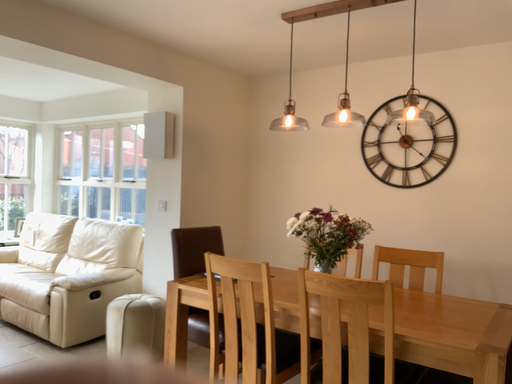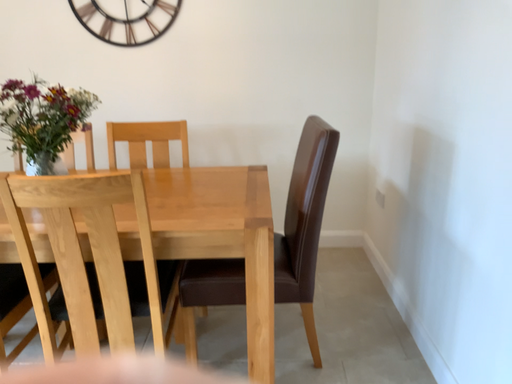
Question: How did the camera likely rotate when shooting the video?

Choices:
 (A) rotated upward
 (B) rotated downward

Answer: (B)